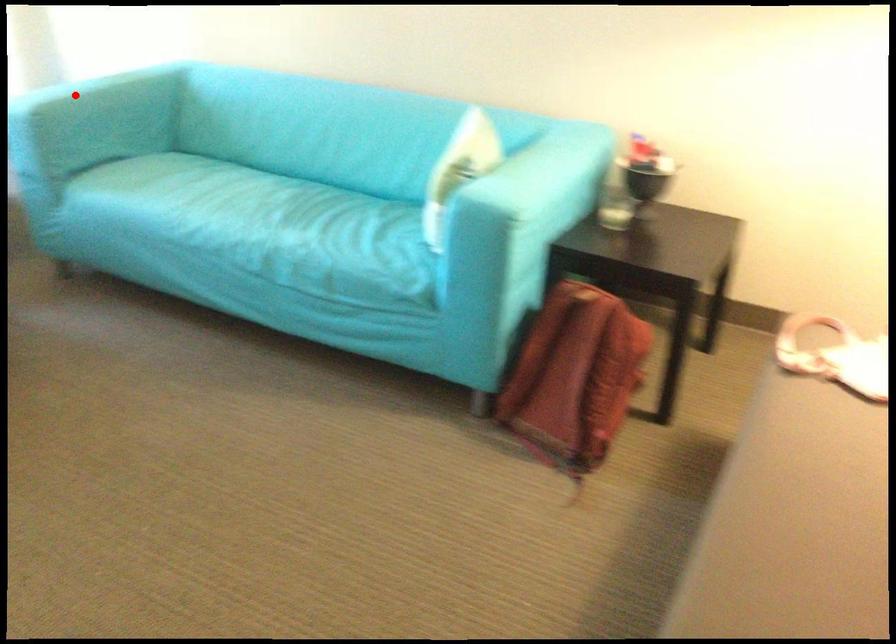
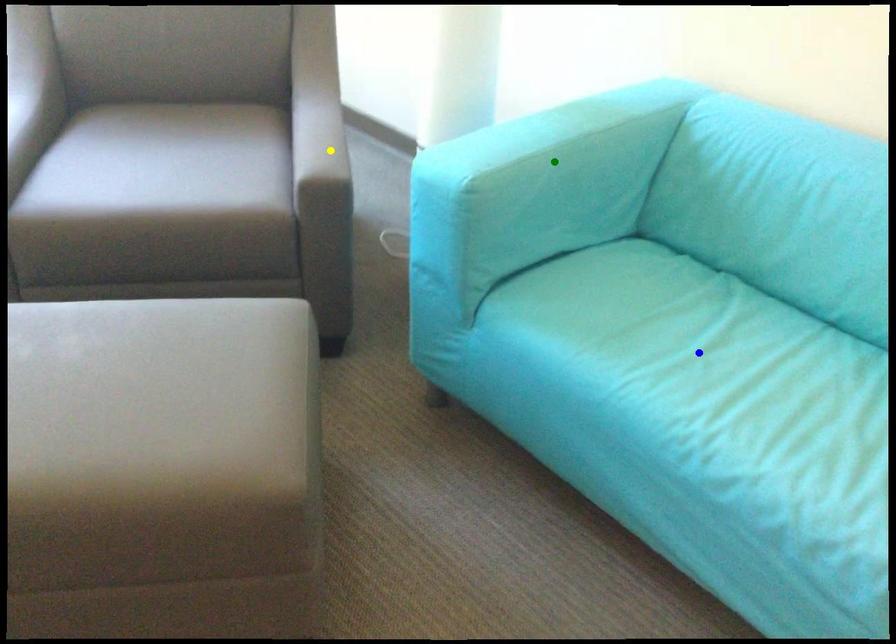
Question: I am providing you with two images of the same scene from different viewpoints. A red point is marked on the first image. You are given multiple points on the second image. Which point in image 2 is actually the same real-world point as the red point in image 1?

Choices:
 (A) blue point
 (B) green point
 (C) yellow point

Answer: (B)